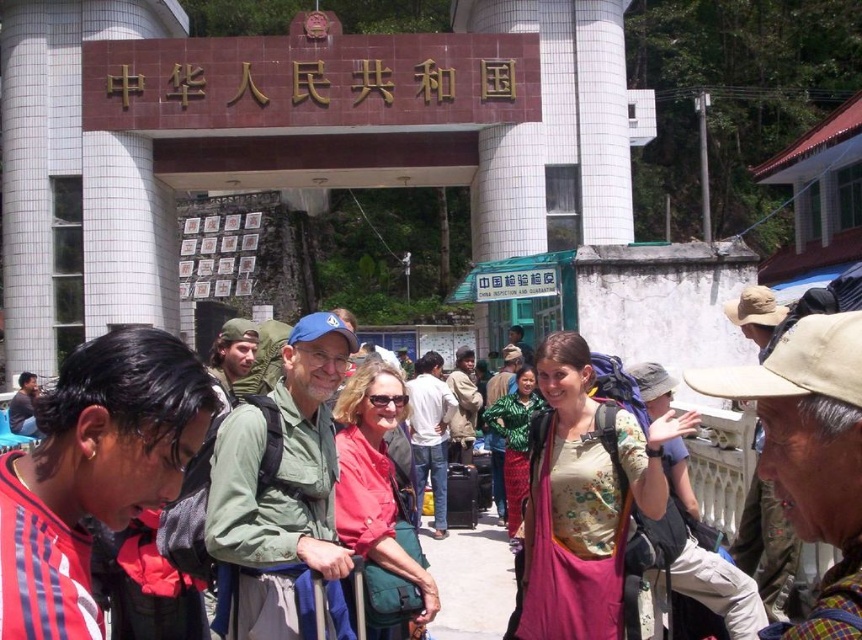
You are standing at the entrance of the border crossing marked with the red signboard. You notice a denim jacket at center. If you want to take a photo of the jacket while including the red signboard in the frame, which direction should you move relative to the jacket?

Since the denim jacket at center is located at point 0.680 on the x axis and 0.500 on the y axis, you should move to the left of the jacket to include the red signboard in the frame.